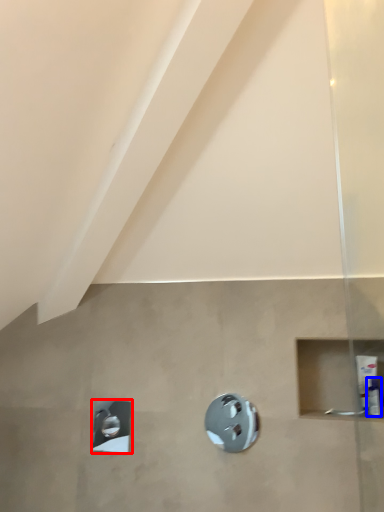
Question: Which point is closer to the camera, shower (highlighted by a red box) or toiletry (highlighted by a blue box)?

Choices:
 (A) shower
 (B) toiletry

Answer: (B)